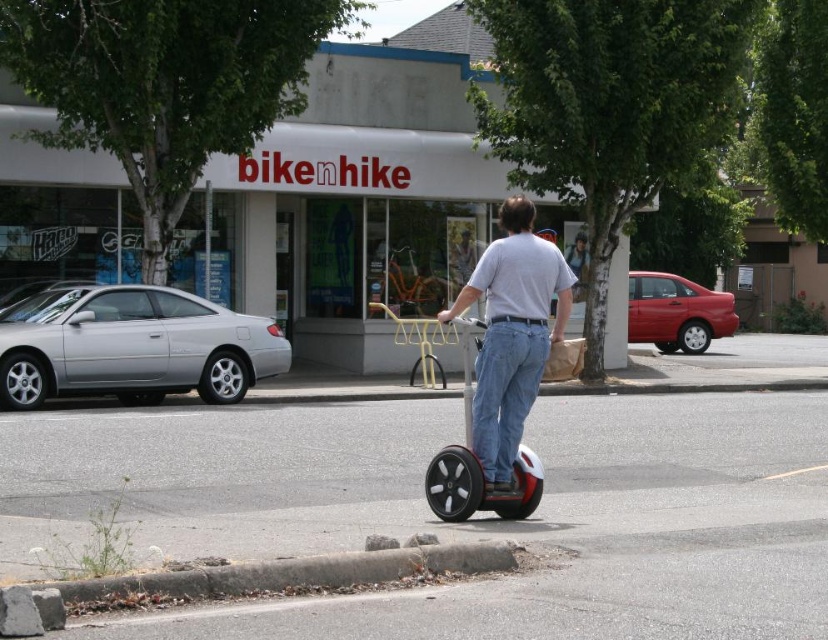
Question: Which of the following is the farthest from the observer?

Choices:
 (A) (497, 404)
 (B) (468, 412)

Answer: (B)

Question: Is white matte segway at center below red glossy scooter at center?

Choices:
 (A) no
 (B) yes

Answer: (A)

Question: Which point is farther from the camera taking this photo?

Choices:
 (A) (533, 259)
 (B) (469, 433)
 (C) (349, 83)

Answer: (C)

Question: Is white matte segway at center to the right of red glossy scooter at center from the viewer's perspective?

Choices:
 (A) no
 (B) yes

Answer: (B)

Question: Is white matte segway at center to the left of red glossy scooter at center from the viewer's perspective?

Choices:
 (A) yes
 (B) no

Answer: (B)

Question: Which point is closer to the camera?

Choices:
 (A) (85, 269)
 (B) (518, 384)
 (C) (467, 449)

Answer: (B)